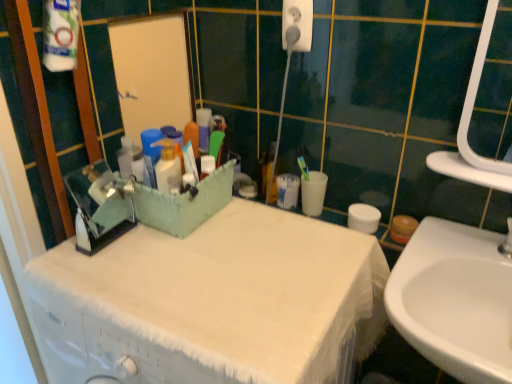
Looking at this image, what is the approximate width of white plastic electric outlet at upper center?

The width of white plastic electric outlet at upper center is 0.59 inches.

Where is `white plastic electric outlet at upper center`? white plastic electric outlet at upper center is located at coordinates (297, 25).

Locate an element on the screen. The height and width of the screenshot is (384, 512). white fabric-covered cabinet at center is located at coordinates (214, 302).

In terms of width, does white fabric-covered cabinet at center look wider or thinner when compared to white plastic electric outlet at upper center?

Considering their sizes, white fabric-covered cabinet at center looks broader than white plastic electric outlet at upper center.

Which is behind, point (51, 363) or point (307, 45)?

The point (307, 45) is behind.

Which of these two, white fabric-covered cabinet at center or white plastic electric outlet at upper center, is smaller?

white plastic electric outlet at upper center.

In order to click on electric outlet that appears above the white fabric-covered cabinet at center (from the image's perspective) in this screenshot , I will do `click(297, 25)`.

Considering the sizes of objects white fabric-covered cabinet at center and white glossy sink at lower right in the image provided, who is smaller, white fabric-covered cabinet at center or white glossy sink at lower right?

With smaller size is white glossy sink at lower right.

Is white fabric-covered cabinet at center completely or partially outside of white glossy sink at lower right?

Absolutely, white fabric-covered cabinet at center is external to white glossy sink at lower right.

How much distance is there between white fabric-covered cabinet at center and white glossy sink at lower right?

A distance of 11.42 inches exists between white fabric-covered cabinet at center and white glossy sink at lower right.

From the image's perspective, does white glossy sink at lower right appear higher than white fabric-covered cabinet at center?

Correct, white glossy sink at lower right appears higher than white fabric-covered cabinet at center in the image.

Does point (455, 330) lie in front of point (134, 357)?

No, it is behind (134, 357).

Locate an element on the screen. The image size is (512, 384). sink to the right of white fabric-covered cabinet at center is located at coordinates (455, 300).

From a real-world perspective, which is physically below, white glossy sink at lower right or white fabric-covered cabinet at center?

In real-world perspective, white fabric-covered cabinet at center is lower.

Does white plastic electric outlet at upper center have a greater height compared to white glossy sink at lower right?

No, white plastic electric outlet at upper center is not taller than white glossy sink at lower right.

Is white plastic electric outlet at upper center oriented towards white glossy sink at lower right?

No, white plastic electric outlet at upper center does not turn towards white glossy sink at lower right.

Looking at their sizes, would you say white plastic electric outlet at upper center is wider or thinner than white glossy sink at lower right?

Clearly, white plastic electric outlet at upper center has less width compared to white glossy sink at lower right.

From a real-world perspective, which object stands above the other?

white plastic electric outlet at upper center, from a real-world perspective.

Looking at this image, could you tell me if white plastic electric outlet at upper center is facing white fabric-covered cabinet at center?

No, white plastic electric outlet at upper center is not turned towards white fabric-covered cabinet at center.

Is white plastic electric outlet at upper center touching white fabric-covered cabinet at center?

No, white plastic electric outlet at upper center is not beside white fabric-covered cabinet at center.

Considering the relative sizes of white plastic electric outlet at upper center and white fabric-covered cabinet at center in the image provided, is white plastic electric outlet at upper center wider than white fabric-covered cabinet at center?

No.

From a real-world perspective, which is physically below, white plastic electric outlet at upper center or white fabric-covered cabinet at center?

white fabric-covered cabinet at center.

From the image's perspective, is white glossy sink at lower right on white plastic electric outlet at upper center?

Incorrect, from the image's perspective, white glossy sink at lower right is lower than white plastic electric outlet at upper center.

Would you say white glossy sink at lower right is outside white plastic electric outlet at upper center?

white glossy sink at lower right lies outside white plastic electric outlet at upper center's area.

Are white glossy sink at lower right and white plastic electric outlet at upper center far apart?

That's not correct — white glossy sink at lower right is a little close to white plastic electric outlet at upper center.

From a real-world perspective, which is physically below, white glossy sink at lower right or white plastic electric outlet at upper center?

In real-world perspective, white glossy sink at lower right is lower.

Locate an element on the screen. This screenshot has height=384, width=512. bathroom cabinet beneath the white plastic electric outlet at upper center (from a real-world perspective) is located at coordinates (214, 302).

Identify the location of bathroom cabinet below the white glossy sink at lower right (from the image's perspective). The image size is (512, 384). (214, 302).

Considering their positions, is white glossy sink at lower right positioned further to white fabric-covered cabinet at center than white plastic electric outlet at upper center?

white plastic electric outlet at upper center is further to white fabric-covered cabinet at center.

Based on their spatial positions, is white glossy sink at lower right or white fabric-covered cabinet at center closer to white plastic electric outlet at upper center?

Among the two, white fabric-covered cabinet at center is located nearer to white plastic electric outlet at upper center.

Looking at the image, which one is located further to white glossy sink at lower right, white fabric-covered cabinet at center or white plastic electric outlet at upper center?

white plastic electric outlet at upper center is further to white glossy sink at lower right.

When comparing their distances from white plastic electric outlet at upper center, does white fabric-covered cabinet at center or white glossy sink at lower right seem closer?

white fabric-covered cabinet at center lies closer to white plastic electric outlet at upper center than the other object.

Looking at the image, which one is located closer to white fabric-covered cabinet at center, white plastic electric outlet at upper center or white glossy sink at lower right?

white glossy sink at lower right.

Considering their positions, is white plastic electric outlet at upper center positioned further to white glossy sink at lower right than white fabric-covered cabinet at center?

The object further to white glossy sink at lower right is white plastic electric outlet at upper center.

You are a GUI agent. You are given a task and a screenshot of the screen. Output one action in this format:
    pyautogui.click(x=<x>, y=<y>)
    Task: Click on the sink between white plastic electric outlet at upper center and white fabric-covered cabinet at center from top to bottom
    
    Given the screenshot: What is the action you would take?
    pyautogui.click(x=455, y=300)